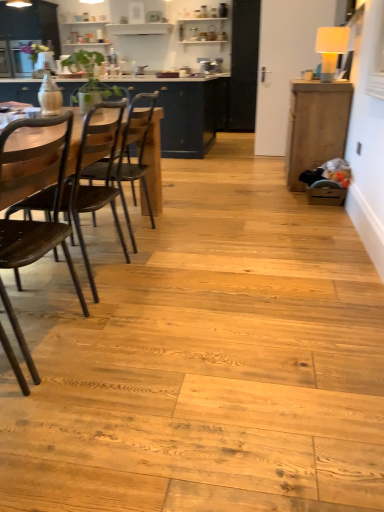
Question: Is wooden cabinet at right, which is the second cabinetry in back-to-front order, in front of or behind dark brown wood chair at left, acting as the first chair starting from the front, in the image?

Choices:
 (A) front
 (B) behind

Answer: (B)

Question: Visually, is wooden cabinet at right, which ranks as the 1th cabinetry in right-to-left order, positioned to the left or to the right of dark brown wood chair at left, acting as the first chair starting from the front?

Choices:
 (A) left
 (B) right

Answer: (B)

Question: Based on their relative distances, which object is nearer to the wooden cabinet at right, which is the second cabinetry in back-to-front order?

Choices:
 (A) matte dark wood cabinet at center, the first cabinetry positioned from the left
 (B) dark brown wood chair at left, which is counted as the 3th chair, starting from the back
 (C) dark wood chair at left, positioned as the second chair in back-to-front order
 (D) wooden chair at left, acting as the first chair starting from the back

Answer: (D)

Question: Estimate the real-world distances between objects in this image. Which object is farther from the wooden cabinet at right, which ranks as the 1th cabinetry in right-to-left order?

Choices:
 (A) dark brown wood chair at left, which is counted as the 3th chair, starting from the back
 (B) dark wood chair at left, positioned as the second chair in back-to-front order
 (C) wooden chair at left, positioned as the 3th chair in front-to-back order
 (D) matte dark wood cabinet at center, the first cabinetry positioned from the left

Answer: (A)